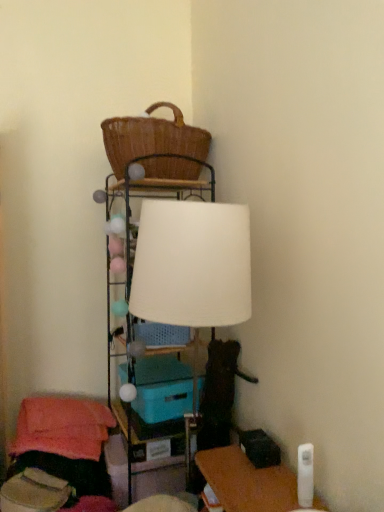
Question: Is teal plastic storage box at center shorter than woven brown basket at upper center?

Choices:
 (A) no
 (B) yes

Answer: (B)

Question: Is teal plastic storage box at center turned away from woven brown basket at upper center?

Choices:
 (A) yes
 (B) no

Answer: (B)

Question: From a real-world perspective, is teal plastic storage box at center physically below woven brown basket at upper center?

Choices:
 (A) yes
 (B) no

Answer: (A)

Question: Does teal plastic storage box at center have a greater width compared to woven brown basket at upper center?

Choices:
 (A) yes
 (B) no

Answer: (B)

Question: From a real-world perspective, is teal plastic storage box at center positioned over woven brown basket at upper center based on gravity?

Choices:
 (A) no
 (B) yes

Answer: (A)

Question: From a real-world perspective, is teal plastic storage box at center above or below woven brown basket at upper center?

Choices:
 (A) above
 (B) below

Answer: (B)

Question: Does point (187, 394) appear closer or farther from the camera than point (157, 140)?

Choices:
 (A) closer
 (B) farther

Answer: (B)

Question: In the image, is teal plastic storage box at center on the left side or the right side of woven brown basket at upper center?

Choices:
 (A) right
 (B) left

Answer: (A)

Question: Looking at the image, does teal plastic storage box at center seem bigger or smaller compared to woven brown basket at upper center?

Choices:
 (A) big
 (B) small

Answer: (B)

Question: Is white matte lampshade at center situated inside teal plastic storage box at center or outside?

Choices:
 (A) inside
 (B) outside

Answer: (B)

Question: Is point click(203, 281) closer or farther from the camera than point click(137, 411)?

Choices:
 (A) farther
 (B) closer

Answer: (B)

Question: Relative to teal plastic storage box at center, is white matte lampshade at center in front or behind?

Choices:
 (A) front
 (B) behind

Answer: (A)

Question: From a real-world perspective, relative to teal plastic storage box at center, is white matte lampshade at center vertically above or below?

Choices:
 (A) above
 (B) below

Answer: (A)

Question: Considering their positions, is matte plastic table at center located in front of or behind teal plastic storage box at center?

Choices:
 (A) front
 (B) behind

Answer: (B)

Question: Considering the positions of point (112, 402) and point (145, 381), is point (112, 402) closer or farther from the camera than point (145, 381)?

Choices:
 (A) farther
 (B) closer

Answer: (A)